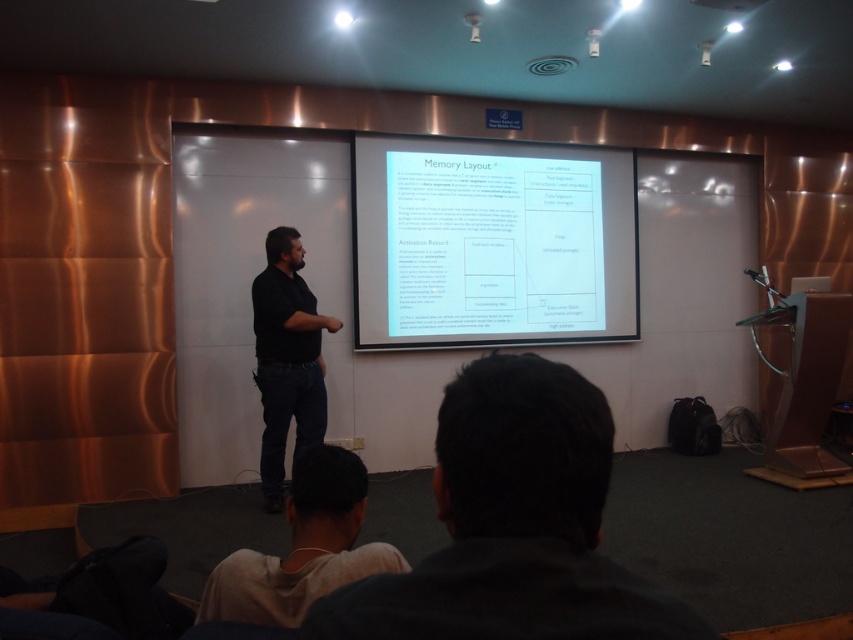
Does white paper at center have a lesser width compared to black matte shirt at center?

Incorrect, white paper at center's width is not less than black matte shirt at center's.

Who is more forward, (614, 305) or (305, 364)?

Point (305, 364)

Between point (619, 216) and point (267, 268), which one is positioned in front?

Point (267, 268)

The width and height of the screenshot is (853, 640). Identify the location of white paper at center. (491, 243).

Is dark hair at lower center in front of white paper at center?

Yes, dark hair at lower center is closer to the viewer.

Does dark hair at lower center appear over white paper at center?

No, dark hair at lower center is not above white paper at center.

Who is more distant from viewer, [444,515] or [556,260]?

Point [556,260]

Where is `dark hair at lower center`? Image resolution: width=853 pixels, height=640 pixels. dark hair at lower center is located at coordinates pos(514,525).

Is dark hair at lower center above white fabric shirt at lower center?

Yes.

Between point (625, 582) and point (253, 611), which one is positioned behind?

Positioned behind is point (253, 611).

In order to click on dark hair at lower center in this screenshot , I will do point(514,525).